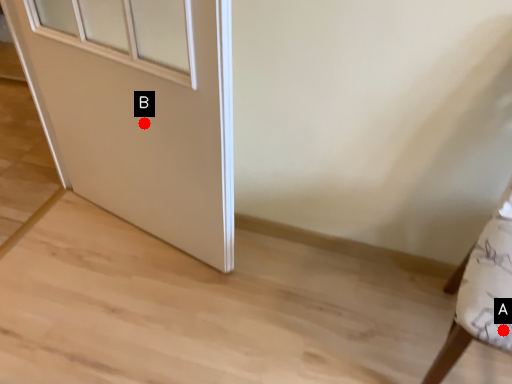
Question: Two points are circled on the image, labeled by A and B beside each circle. Which point appears closest to the camera in this image?

Choices:
 (A) A is closer
 (B) B is closer

Answer: (A)